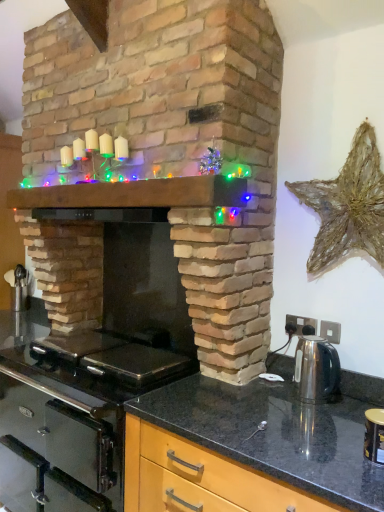
The image size is (384, 512). I want to click on vacant space to the left of satin silver kettle at right, so click(255, 399).